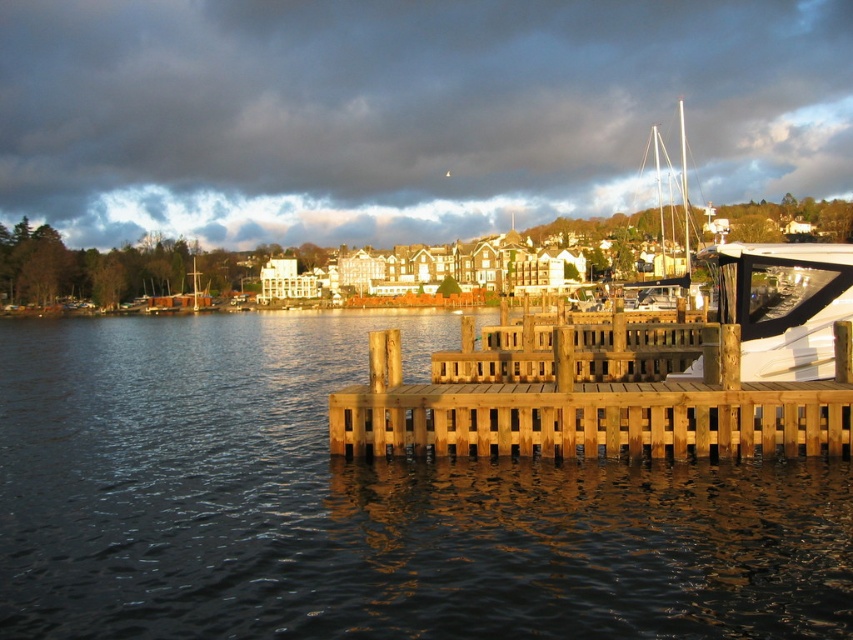
From the picture: You are a painter setting up your easel on the brown wooden dock at lower center. You want to paint the white matte boat at center. Since the dock is wider than the boat, will you have enough space to position yourself comfortably to paint the boat without needing to move your easel?

The brown wooden dock at lower center is wider than the white matte boat at center, so yes, you will have enough space to position yourself comfortably on the dock to paint the boat without needing to move your easel.

You are standing on the brown wooden dock at lower center and want to board the white matte boat at center. In which direction should you walk to reach the boat?

You should walk to the right because the brown wooden dock at lower center is to the left of the white matte boat at center, so moving right will lead you towards the boat.

You are standing on the brown wooden dock at lower center and want to board the white matte boat at center. Considering their heights, will you need to climb up or step down to get onto the boat?

The brown wooden dock at lower center has a greater height compared to the white matte boat at center, so you will need to step down to board the boat.